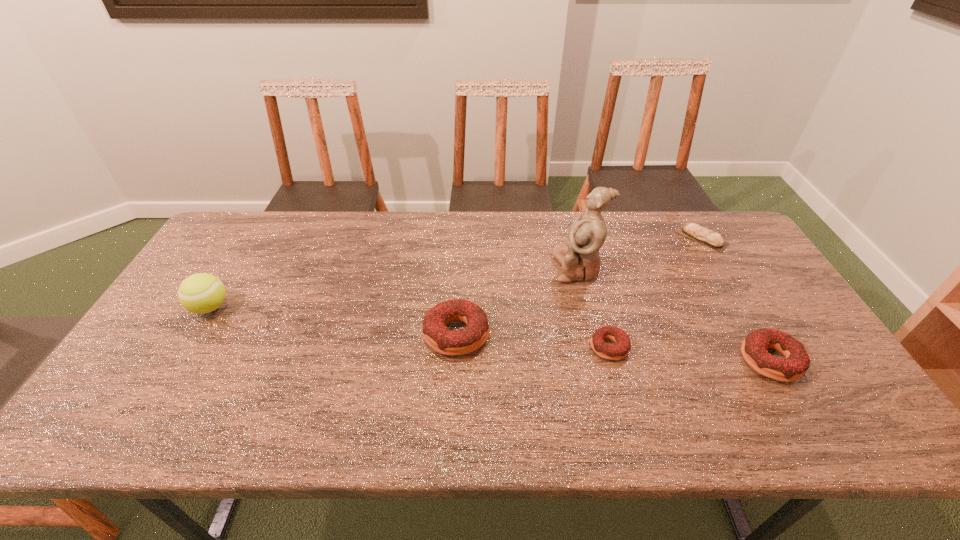
The height and width of the screenshot is (540, 960). I want to click on blank space at the far right corner of the desktop, so click(x=684, y=213).

Where is `free area in between the rightmost doughnut and the pita bread`? The image size is (960, 540). free area in between the rightmost doughnut and the pita bread is located at coordinates [x=736, y=299].

Where is `free spot between the second object from left to right and the pita bread`? The image size is (960, 540). free spot between the second object from left to right and the pita bread is located at coordinates (579, 286).

Locate an element on the screen. This screenshot has height=540, width=960. vacant area between the tennis ball and the pita bread is located at coordinates point(456,273).

You are a GUI agent. You are given a task and a screenshot of the screen. Output one action in this format:
    pyautogui.click(x=<x>, y=<y>)
    Task: Click on the free space between the second object from left to right and the figurine
    The image size is (960, 540).
    Given the screenshot: What is the action you would take?
    pyautogui.click(x=517, y=301)

Find the location of a particular element. This screenshot has width=960, height=540. vacant point located between the shortest doughnut and the second tallest doughnut is located at coordinates (689, 354).

You are a GUI agent. You are given a task and a screenshot of the screen. Output one action in this format:
    pyautogui.click(x=<x>, y=<y>)
    Task: Click on the unoccupied position between the second object from left to right and the leftmost object
    
    Given the screenshot: What is the action you would take?
    tap(333, 321)

Locate an element on the screen. free space between the leftmost doughnut and the second doughnut from left to right is located at coordinates (533, 341).

Locate an element on the screen. This screenshot has width=960, height=540. blank region between the tennis ball and the pita bread is located at coordinates (456, 273).

This screenshot has height=540, width=960. What are the coordinates of `free spot between the fourth tallest object and the pita bread` in the screenshot? It's located at (736, 299).